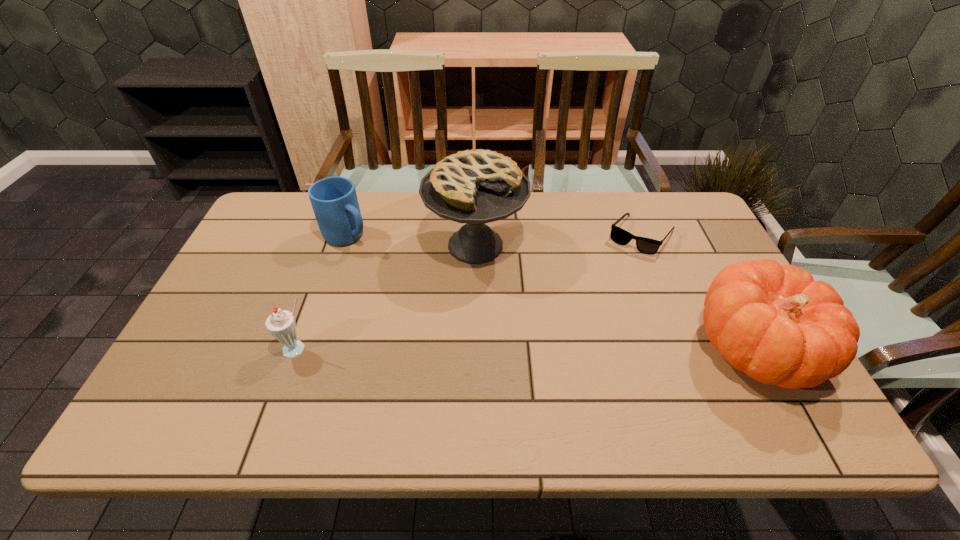
You are a GUI agent. You are given a task and a screenshot of the screen. Output one action in this format:
    pyautogui.click(x=<x>, y=<y>)
    Task: Click on the vacant space at the far right corner
    The image size is (960, 540).
    Given the screenshot: What is the action you would take?
    [x=667, y=227]

Image resolution: width=960 pixels, height=540 pixels. In order to click on vacant area between the fourth shortest object and the mug in this screenshot , I will do `click(550, 293)`.

Where is `empty space that is in between the third object from right to left and the milkshake`? The height and width of the screenshot is (540, 960). empty space that is in between the third object from right to left and the milkshake is located at coordinates (387, 298).

Image resolution: width=960 pixels, height=540 pixels. Identify the location of vacant space in between the pumpkin and the sunglasses. (697, 293).

This screenshot has height=540, width=960. In order to click on free space between the pumpkin and the milkshake in this screenshot , I will do `click(526, 349)`.

The width and height of the screenshot is (960, 540). I want to click on free space between the mug and the milkshake, so [x=323, y=293].

At what (x,y) coordinates should I click in order to perform the action: click on free spot between the second tallest object and the milkshake. Please return your answer as a coordinate pair (x, y). The width and height of the screenshot is (960, 540). Looking at the image, I should click on (526, 349).

Find the location of a particular element. The height and width of the screenshot is (540, 960). unoccupied area between the fourth shortest object and the shortest object is located at coordinates (697, 293).

At what (x,y) coordinates should I click in order to perform the action: click on vacant space that's between the tallest object and the milkshake. Please return your answer as a coordinate pair (x, y). The height and width of the screenshot is (540, 960). Looking at the image, I should click on (387, 298).

Image resolution: width=960 pixels, height=540 pixels. I want to click on the second closest object to the mug, so point(281,324).